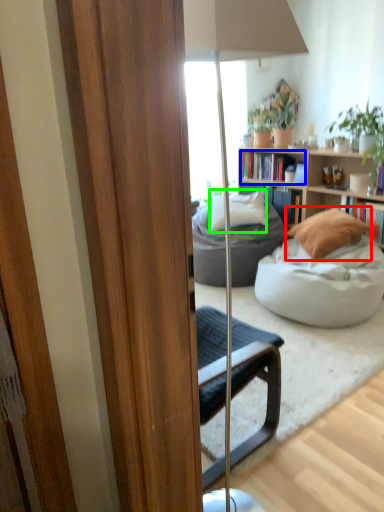
Question: Considering the real-world distances, which object is farthest from pillow (highlighted by a red box)? book (highlighted by a blue box) or pillow (highlighted by a green box)?

Choices:
 (A) book
 (B) pillow

Answer: (A)